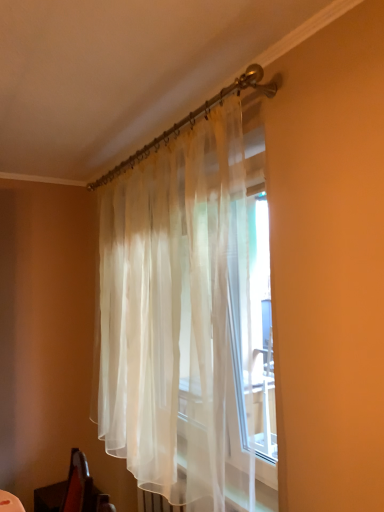
Question: Is translucent white curtain at upper center at the left side of wooden swivel chair at lower left?

Choices:
 (A) yes
 (B) no

Answer: (B)

Question: From a real-world perspective, is translucent white curtain at upper center positioned under wooden swivel chair at lower left based on gravity?

Choices:
 (A) yes
 (B) no

Answer: (B)

Question: Is translucent white curtain at upper center positioned behind wooden swivel chair at lower left?

Choices:
 (A) no
 (B) yes

Answer: (A)

Question: Is translucent white curtain at upper center not within wooden swivel chair at lower left?

Choices:
 (A) yes
 (B) no

Answer: (A)

Question: Does translucent white curtain at upper center have a smaller size compared to wooden swivel chair at lower left?

Choices:
 (A) yes
 (B) no

Answer: (B)

Question: Does translucent white curtain at upper center have a larger size compared to wooden swivel chair at lower left?

Choices:
 (A) yes
 (B) no

Answer: (A)

Question: Could you tell me if wooden swivel chair at lower left is turned towards translucent white curtain at upper center?

Choices:
 (A) yes
 (B) no

Answer: (B)

Question: Considering the relative sizes of wooden swivel chair at lower left and translucent white curtain at upper center in the image provided, is wooden swivel chair at lower left wider than translucent white curtain at upper center?

Choices:
 (A) yes
 (B) no

Answer: (A)

Question: Can you see wooden swivel chair at lower left touching translucent white curtain at upper center?

Choices:
 (A) no
 (B) yes

Answer: (A)

Question: Is wooden swivel chair at lower left smaller than translucent white curtain at upper center?

Choices:
 (A) yes
 (B) no

Answer: (A)

Question: From a real-world perspective, is wooden swivel chair at lower left on translucent white curtain at upper center?

Choices:
 (A) no
 (B) yes

Answer: (A)

Question: Is wooden swivel chair at lower left positioned with its back to translucent white curtain at upper center?

Choices:
 (A) no
 (B) yes

Answer: (A)

Question: Is translucent white curtain at upper center taller or shorter than wooden swivel chair at lower left?

Choices:
 (A) tall
 (B) short

Answer: (A)